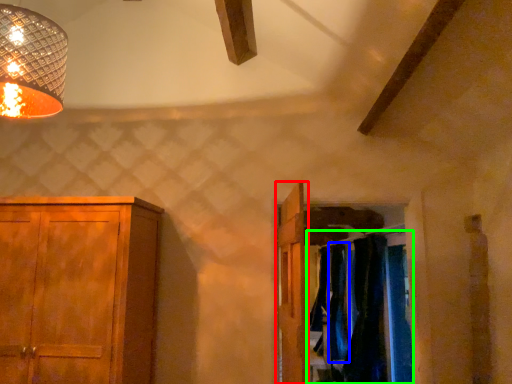
Question: Which is farther away from door (highlighted by a red box)? curtain (highlighted by a blue box) or laundry (highlighted by a green box)?

Choices:
 (A) curtain
 (B) laundry

Answer: (A)